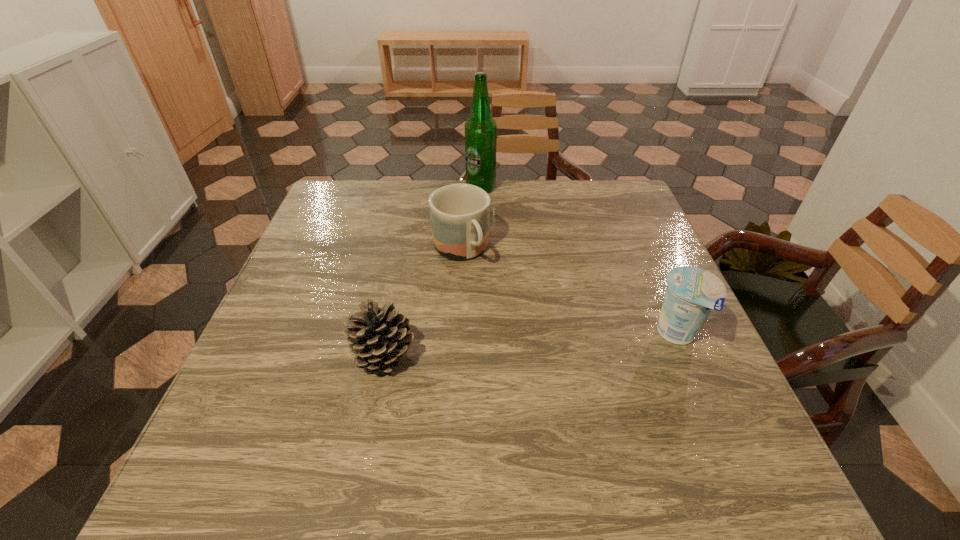
Find the location of a particular element. vacant space on the desktop that is between the pinecone and the rightmost object and is positioned on the side with the handle of the second farthest object is located at coordinates (524, 345).

You are a GUI agent. You are given a task and a screenshot of the screen. Output one action in this format:
    pyautogui.click(x=<x>, y=<y>)
    Task: Click on the vacant space on the desktop that is between the pinecone and the yogurt and is positioned on the label of the beer bottle
    
    Given the screenshot: What is the action you would take?
    pyautogui.click(x=491, y=347)